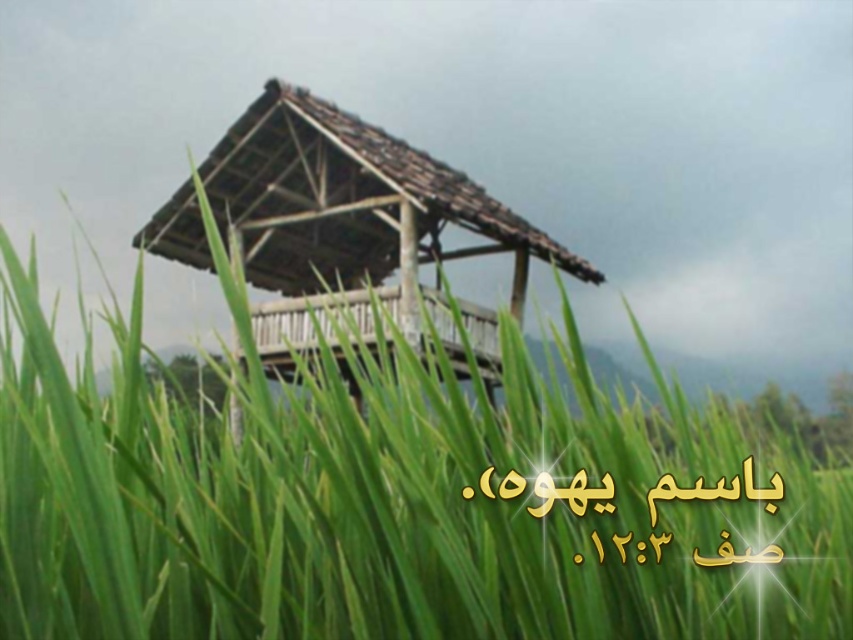
Who is positioned more to the right, green grass at center or wooden gazebo at center?

green grass at center is more to the right.

Where is `green grass at center`? green grass at center is located at coordinates coord(397,500).

Does point (178, 595) come closer to viewer compared to point (361, 307)?

Yes.

Where is `green grass at center`? This screenshot has width=853, height=640. green grass at center is located at coordinates (397, 500).